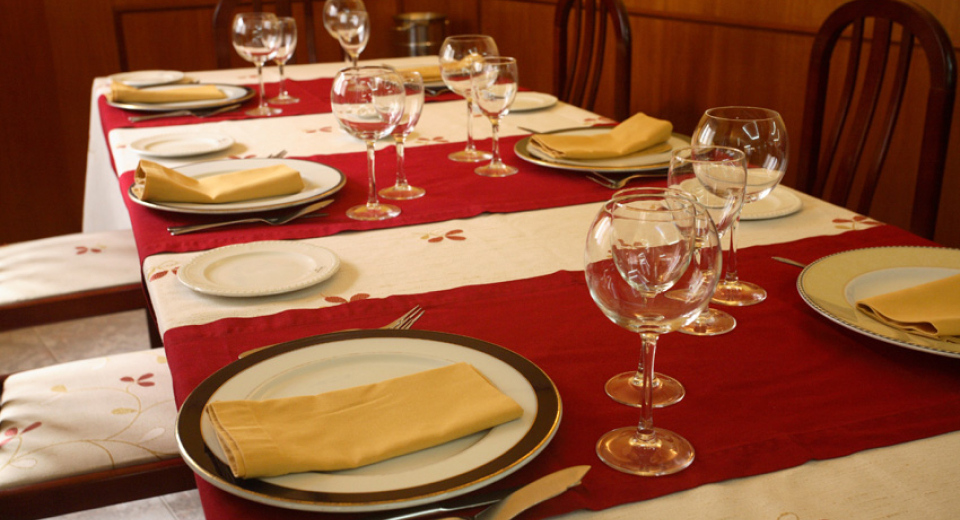
Find the location of a particular element. The width and height of the screenshot is (960, 520). cloth napkins on plates on table is located at coordinates (363, 429), (919, 305), (595, 144), (221, 185), (180, 93), (430, 74).